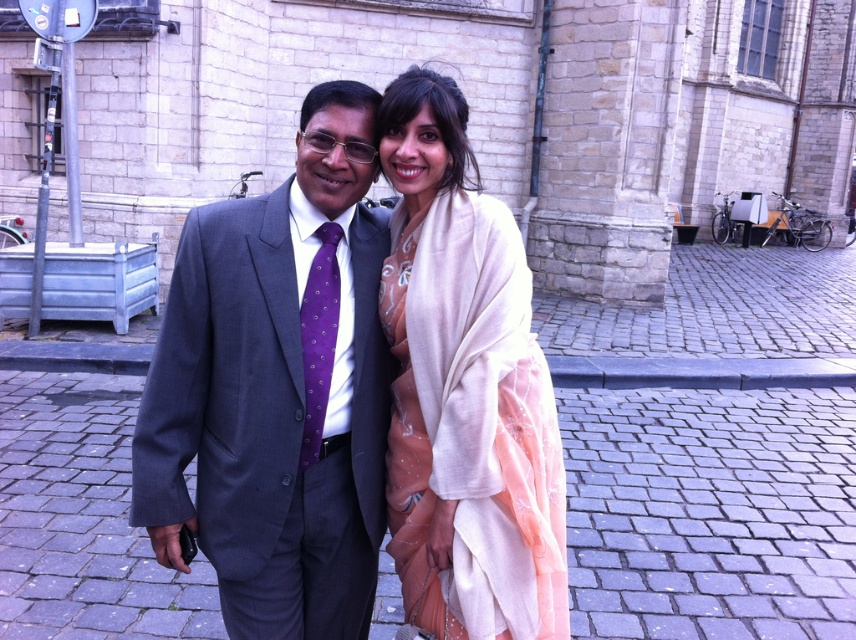
You are taking a photo of two people standing on a cobblestone street. You notice two points marked in the image. The first point is at coordinate point (x=473, y=536) and the second is at point (x=317, y=380). Which point is closer to the camera?

Point (x=473, y=536) is closer to the camera than point (x=317, y=380).

You are taking a photo of two people standing on a cobblestone street. You notice two points marked at coordinates point (226, 216) and point (486, 356). According to the image, which point is closer to the camera?

Point (486, 356) is closer to the camera because point (226, 216) is behind it.

Consider the image. You are a photographer trying to adjust the lighting for a photo shoot. You notice the matte gray suit at center is positioned at point (x=277, y=388). Where exactly should you place your reflector to ensure it faces the correct direction for optimal lighting on the matte gray suit at center?

The reflector should be placed facing the direction of the matte gray suit at center located at point (x=277, y=388) to ensure optimal lighting.